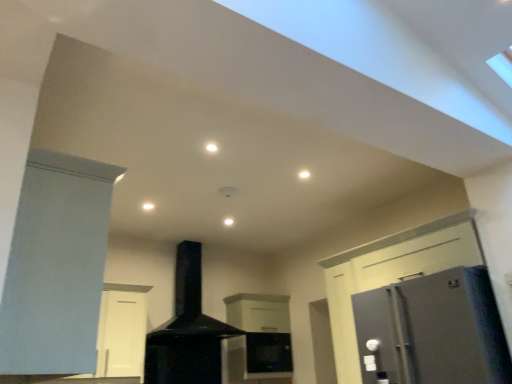
What do you see at coordinates (258, 340) in the screenshot? I see `white matte cabinet at center, the 1th cabinetry when ordered from right to left` at bounding box center [258, 340].

Measure the distance between point (57,250) and camera.

A distance of 1.67 meters exists between point (57,250) and camera.

The height and width of the screenshot is (384, 512). What are the coordinates of `satin silver refrigerator at right` in the screenshot? It's located at (432, 331).

Is matte white cabinet at left, the 1th cabinetry viewed from the left, inside the boundaries of black matte chimney at center, or outside?

The correct answer is: outside.

Is matte white cabinet at left, which is counted as the second cabinetry, starting from the back, thinner than black matte chimney at center?

Indeed, matte white cabinet at left, which is counted as the second cabinetry, starting from the back, has a lesser width compared to black matte chimney at center.

How far apart are matte white cabinet at left, the first cabinetry when ordered from front to back, and black matte chimney at center?

They are 2.85 meters apart.

Is matte white cabinet at left, which is counted as the second cabinetry, starting from the back, further to the viewer compared to black matte chimney at center?

That is False.

From the image's perspective, who appears lower, white matte cabinet at center, the 2th cabinetry from the front, or black matte chimney at center?

From the image's view, white matte cabinet at center, the 2th cabinetry from the front, is below.

Which point is more distant from viewer, (253,309) or (189,257)?

The point (253,309) is farther from the camera.

Can you tell me how much white matte cabinet at center, the first cabinetry viewed from the back, and black matte chimney at center differ in facing direction?

The facing directions of white matte cabinet at center, the first cabinetry viewed from the back, and black matte chimney at center are 0.617 degrees apart.

Is white matte cabinet at center, the first cabinetry viewed from the back, looking in the opposite direction of black matte chimney at center?

No, black matte chimney at center is not at the back of white matte cabinet at center, the first cabinetry viewed from the back.

Which is further, (80, 365) or (463, 283)?

The point (463, 283) is farther from the camera.

Could you measure the distance between matte white cabinet at left, the first cabinetry when ordered from front to back, and satin silver refrigerator at right?

A distance of 6.62 feet exists between matte white cabinet at left, the first cabinetry when ordered from front to back, and satin silver refrigerator at right.

Is matte white cabinet at left, the second cabinetry viewed from the right, at the left side of satin silver refrigerator at right?

Yes.

Which object is wider, matte white cabinet at left, the second cabinetry viewed from the right, or satin silver refrigerator at right?

satin silver refrigerator at right.

Is matte white cabinet at left, the 1th cabinetry viewed from the left, oriented towards white matte cabinet at center, the 2th cabinetry from the front?

Yes, matte white cabinet at left, the 1th cabinetry viewed from the left, is oriented towards white matte cabinet at center, the 2th cabinetry from the front.

From a real-world perspective, which object stands above the other?

In real-world perspective, matte white cabinet at left, the 1th cabinetry viewed from the left, is above.

Is matte white cabinet at left, which is counted as the second cabinetry, starting from the back, positioned far away from white matte cabinet at center, the first cabinetry viewed from the back?

matte white cabinet at left, which is counted as the second cabinetry, starting from the back, is far away from white matte cabinet at center, the first cabinetry viewed from the back.

From the image's perspective, which is below, matte white cabinet at left, the first cabinetry when ordered from front to back, or white matte cabinet at center, the first cabinetry viewed from the back?

white matte cabinet at center, the first cabinetry viewed from the back, from the image's perspective.

Between point (276, 341) and point (33, 326), which one is positioned in front?

The point (33, 326) is closer.

In terms of height, does white matte cabinet at center, the 1th cabinetry when ordered from right to left, look taller or shorter compared to matte white cabinet at left, which is counted as the second cabinetry, starting from the back?

In the image, white matte cabinet at center, the 1th cabinetry when ordered from right to left, appears to be taller than matte white cabinet at left, which is counted as the second cabinetry, starting from the back.

Can you confirm if black matte chimney at center is shorter than white matte cabinet at center, placed as the second cabinetry when sorted from left to right?

Incorrect, the height of black matte chimney at center does not fall short of that of white matte cabinet at center, placed as the second cabinetry when sorted from left to right.

From a real-world perspective, which is physically below, black matte chimney at center or white matte cabinet at center, the 2th cabinetry from the front?

white matte cabinet at center, the 2th cabinetry from the front, from a real-world perspective.

Which is less distant, (161,342) or (280,346)?

Point (161,342).

Visually, is black matte chimney at center positioned to the left or to the right of white matte cabinet at center, the 1th cabinetry when ordered from right to left?

black matte chimney at center is positioned on white matte cabinet at center, the 1th cabinetry when ordered from right to left,'s left side.

Is black matte chimney at center inside or outside of satin silver refrigerator at right?

black matte chimney at center is not inside satin silver refrigerator at right, it's outside.

Is black matte chimney at center positioned with its back to satin silver refrigerator at right?

No, black matte chimney at center's orientation is not away from satin silver refrigerator at right.

Considering the positions of point (166, 360) and point (449, 298), is point (166, 360) closer or farther from the camera than point (449, 298)?

Point (166, 360).

Between black matte chimney at center and satin silver refrigerator at right, which one has larger width?

With larger width is satin silver refrigerator at right.

The width and height of the screenshot is (512, 384). Identify the location of cabinetry above the black matte chimney at center (from the image's perspective). (56, 266).

Where is `cabinetry lying behind the black matte chimney at center`? Image resolution: width=512 pixels, height=384 pixels. cabinetry lying behind the black matte chimney at center is located at coordinates (258, 340).

Based on their spatial positions, is satin silver refrigerator at right or white matte cabinet at center, the 2th cabinetry from the front, further from matte white cabinet at left, the second cabinetry viewed from the right?

white matte cabinet at center, the 2th cabinetry from the front, is further to matte white cabinet at left, the second cabinetry viewed from the right.

Looking at the image, which one is located closer to matte white cabinet at left, which is counted as the second cabinetry, starting from the back, white matte cabinet at center, the 1th cabinetry when ordered from right to left, or satin silver refrigerator at right?

satin silver refrigerator at right is closer to matte white cabinet at left, which is counted as the second cabinetry, starting from the back.

Considering their positions, is white matte cabinet at center, the 1th cabinetry when ordered from right to left, positioned further to satin silver refrigerator at right than matte white cabinet at left, the 1th cabinetry viewed from the left?

white matte cabinet at center, the 1th cabinetry when ordered from right to left, lies further to satin silver refrigerator at right than the other object.

When comparing their distances from black matte chimney at center, does matte white cabinet at left, the first cabinetry when ordered from front to back, or satin silver refrigerator at right seem further?

matte white cabinet at left, the first cabinetry when ordered from front to back, is further to black matte chimney at center.

Considering their positions, is black matte chimney at center positioned closer to matte white cabinet at left, the first cabinetry when ordered from front to back, than white matte cabinet at center, placed as the second cabinetry when sorted from left to right?

Based on the image, black matte chimney at center appears to be nearer to matte white cabinet at left, the first cabinetry when ordered from front to back.

Looking at the image, which one is located closer to matte white cabinet at left, which is counted as the second cabinetry, starting from the back, satin silver refrigerator at right or black matte chimney at center?

satin silver refrigerator at right is closer to matte white cabinet at left, which is counted as the second cabinetry, starting from the back.

Considering their positions, is white matte cabinet at center, the 1th cabinetry when ordered from right to left, positioned further to black matte chimney at center than satin silver refrigerator at right?

satin silver refrigerator at right.

Estimate the real-world distances between objects in this image. Which object is further from white matte cabinet at center, placed as the second cabinetry when sorted from left to right, black matte chimney at center or matte white cabinet at left, the first cabinetry when ordered from front to back?

Based on the image, matte white cabinet at left, the first cabinetry when ordered from front to back, appears to be further to white matte cabinet at center, placed as the second cabinetry when sorted from left to right.

The image size is (512, 384). I want to click on fireplace positioned between matte white cabinet at left, which is counted as the second cabinetry, starting from the back, and white matte cabinet at center, placed as the second cabinetry when sorted from left to right, from near to far, so click(x=187, y=331).

What are the coordinates of `fireplace between matte white cabinet at left, which is counted as the second cabinetry, starting from the back, and satin silver refrigerator at right` in the screenshot? It's located at (187, 331).

The image size is (512, 384). What are the coordinates of `refrigerator between matte white cabinet at left, the second cabinetry viewed from the right, and white matte cabinet at center, the 2th cabinetry from the front, along the z-axis` in the screenshot? It's located at (432, 331).

I want to click on fireplace between satin silver refrigerator at right and white matte cabinet at center, the 1th cabinetry when ordered from right to left, from front to back, so click(187, 331).